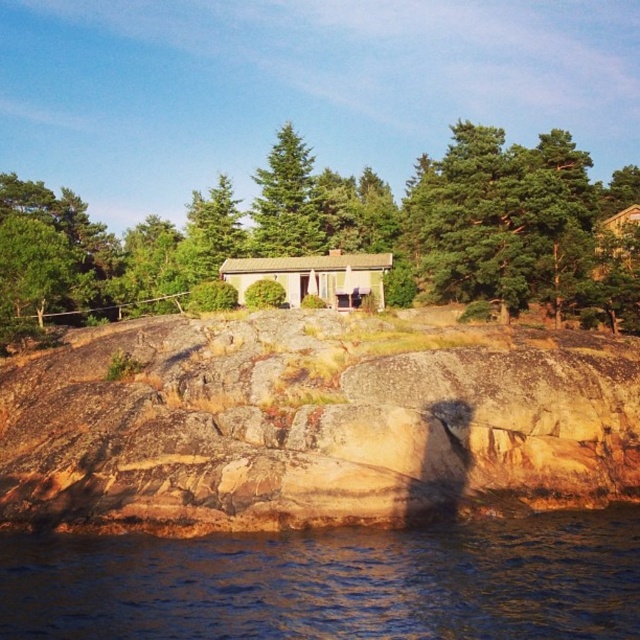
You are standing at the rocky shoreline and want to reach the blue water at lower left without going through the green leafy tree at center. Is there a path around the tree to your left or right?

The blue water at lower left is behind the green leafy tree at center, so you can go around the tree to either side to reach the blue water at lower left without passing through it.

You are standing on the rocky shoreline and want to reach the blue water at lower left without getting your feet wet. Which direction should you move relative to the green leafy tree at center?

You should move towards the blue water at lower left, which is located below the green leafy tree at center. Since the tree is positioned over the water, moving toward the lower left direction from the tree will lead you to the water without getting wet until you reach it.

You are a delivery drone carrying a package to the light brown wooden cottage at center. You are currently hovering above the blue water at lower left. What is the shortest distance you need to fly to reach the cottage?

The shortest distance between the blue water at lower left and the light brown wooden cottage at center is 32.53 meters, so you need to fly 32.53 meters to reach the cottage.